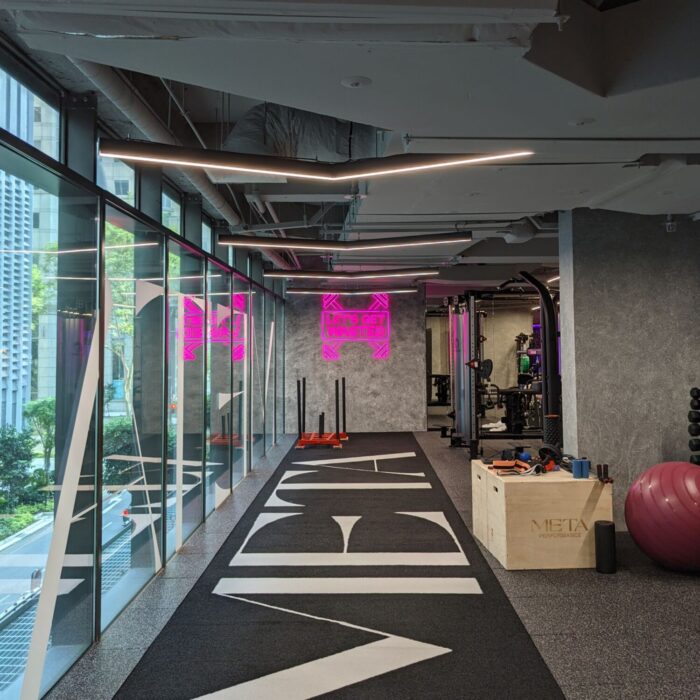
Find the location of a particular element. wooden boxes is located at coordinates (524, 514), (474, 495).